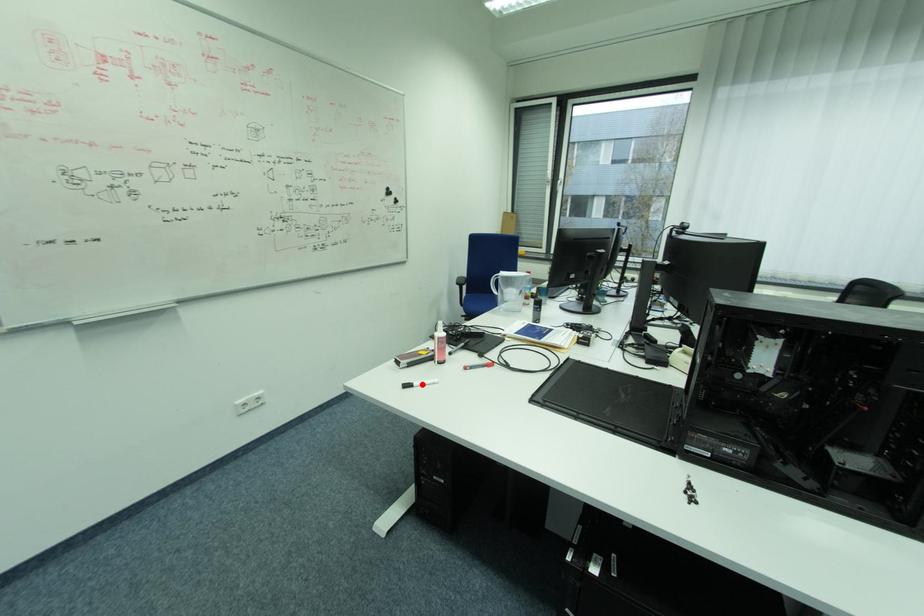
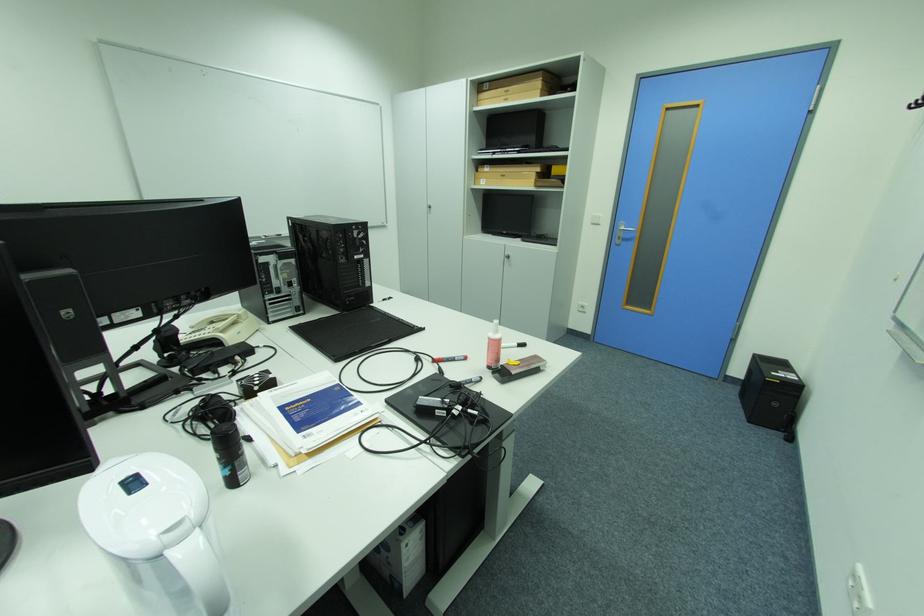
Question: I am providing you with two images of the same scene from different viewpoints. A red point is marked on the first image. Is the red point's position out of view in image 2?

Choices:
 (A) Yes
 (B) No

Answer: (A)